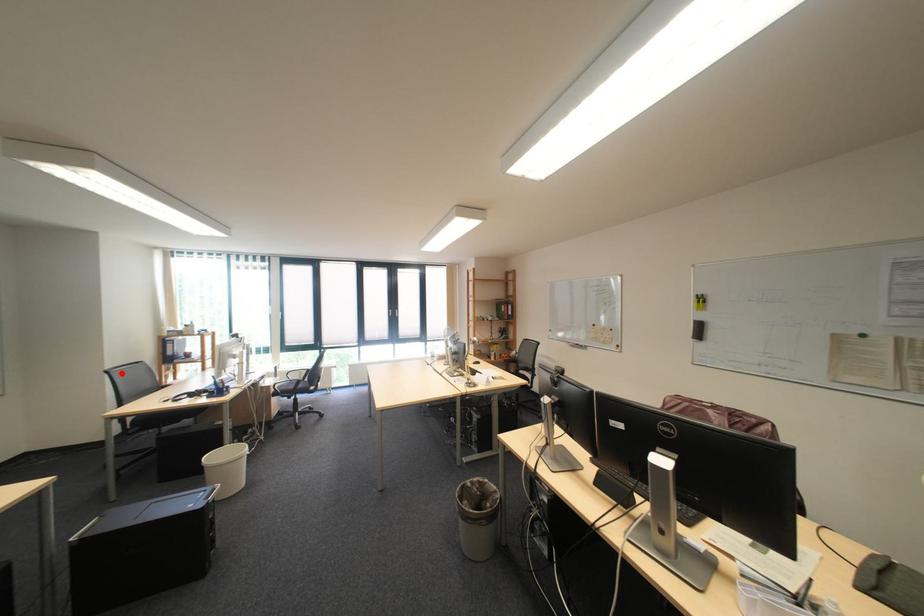
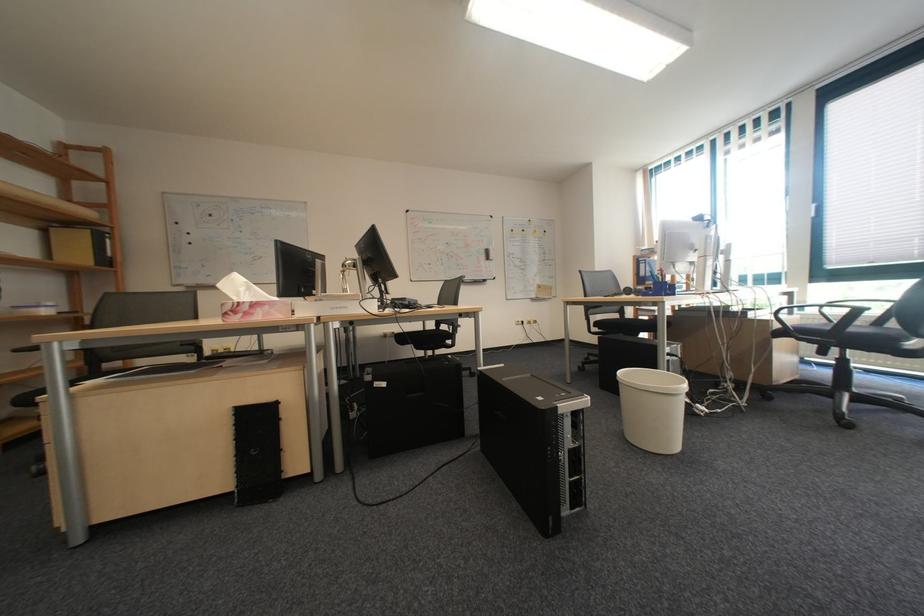
Question: I am providing you with two images of the same scene from different viewpoints. Given a red point in image1, look at the same physical point in image2. Is it:

Choices:
 (A) Closer to the viewpoint
 (B) Farther from the viewpoint

Answer: (A)